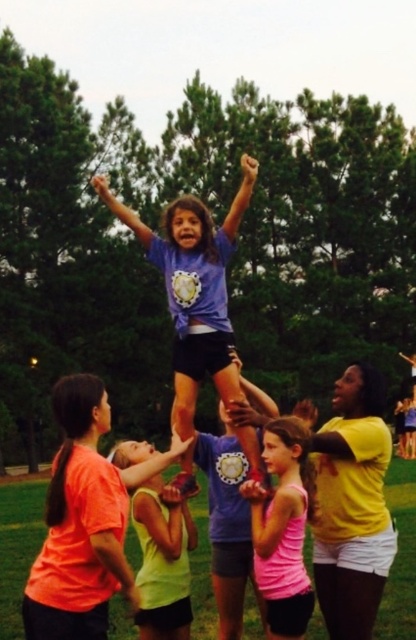
Based on the photo, in the scene, there are two participants wearing the purple matte shirt at center and the neon yellow tank top at center. Which one is positioned to the left?

The purple matte shirt at center is to the left of neon yellow tank top at center.

Consider the image. You are a photographer positioned at the center of the scene. You want to take a photo focusing on the two points labeled as point (182, 401) and point (270, 448). Which point will appear closer to the camera in your photo?

Point (182, 401) is further to the camera than point (270, 448), so in the photo, point (182, 401) will appear closer to the camera than point (270, 448).